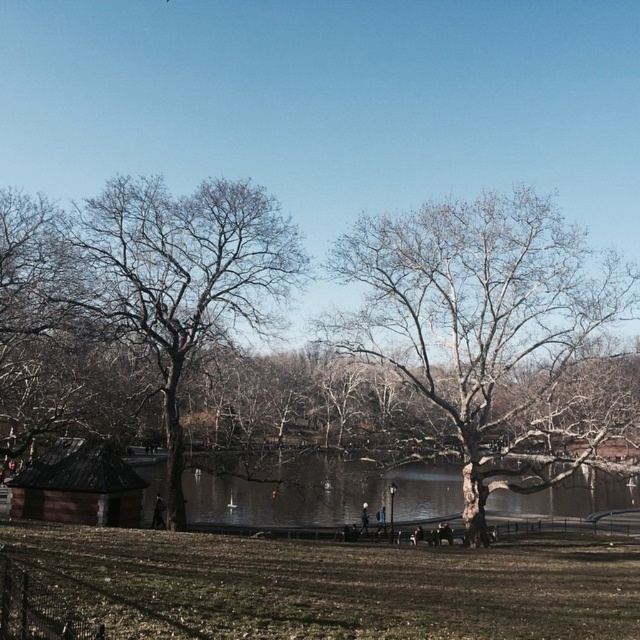
Describe the element at coordinates (182, 275) in the screenshot. I see `bare wood tree at left` at that location.

Who is positioned more to the right, bare wood tree at left or clear water at center?

From the viewer's perspective, clear water at center appears more on the right side.

Image resolution: width=640 pixels, height=640 pixels. Find the location of `bare wood tree at left`. bare wood tree at left is located at coordinates (182, 275).

Is the position of bare wood tree at center less distant than that of bare wood tree at left?

No, bare wood tree at center is behind bare wood tree at left.

This screenshot has width=640, height=640. What do you see at coordinates (490, 333) in the screenshot?
I see `bare wood tree at center` at bounding box center [490, 333].

At what (x,y) coordinates should I click in order to perform the action: click on bare wood tree at center. Please return your answer as a coordinate pair (x, y). This screenshot has width=640, height=640. Looking at the image, I should click on (490, 333).

Which is more to the left, bare wood tree at center or clear water at center?

From the viewer's perspective, clear water at center appears more on the left side.

Does bare wood tree at center lie behind clear water at center?

No.

Does point (497, 204) come in front of point (212, 500)?

Yes, point (497, 204) is closer to viewer.

This screenshot has height=640, width=640. I want to click on bare wood tree at center, so click(490, 333).